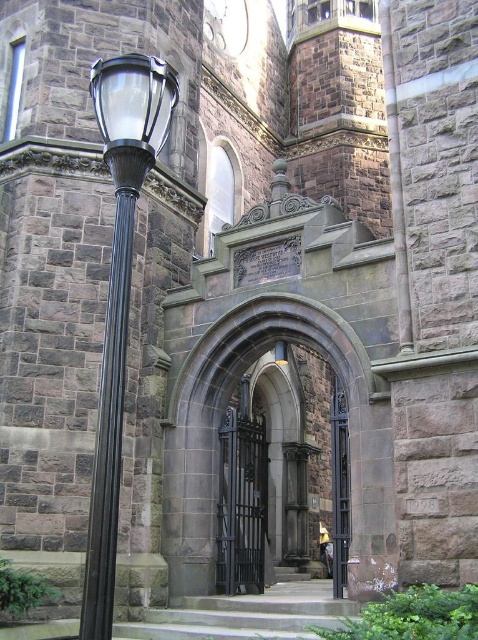
Question: Which point appears farthest from the camera in this image?

Choices:
 (A) (332, 474)
 (B) (228, 412)
 (C) (108, 496)

Answer: (A)

Question: Which of these objects is positioned farthest from the black polished metal pole at left?

Choices:
 (A) polished dark wood door at center
 (B) black wrought iron gate at center

Answer: (B)

Question: Does black wrought iron gate at center have a larger size compared to polished dark wood door at center?

Choices:
 (A) yes
 (B) no

Answer: (B)

Question: Is black polished metal pole at left smaller than polished dark wood door at center?

Choices:
 (A) yes
 (B) no

Answer: (A)

Question: Can you confirm if black polished metal pole at left is positioned to the right of black wrought iron gate at center?

Choices:
 (A) no
 (B) yes

Answer: (A)

Question: Which point appears closest to the camera in this image?

Choices:
 (A) (242, 484)
 (B) (98, 560)
 (C) (333, 456)

Answer: (B)